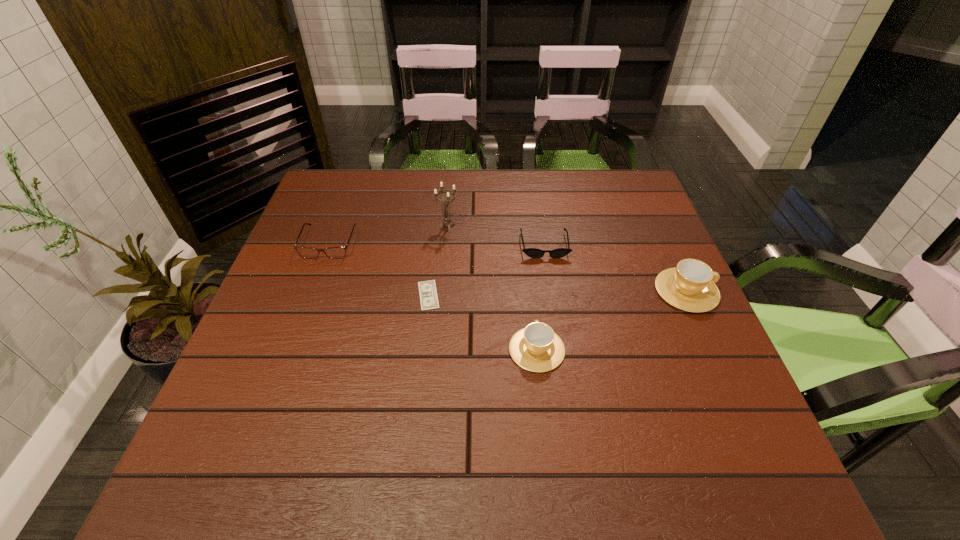
This screenshot has height=540, width=960. Identify the location of empty space between the spectacles and the fifth tallest object. (437, 244).

Identify the location of free space between the shortest object and the second shortest object. (486, 270).

Point out which object is positioned as the third nearest to the shorter cup. Please provide its 2D coordinates. Your answer should be formatted as a tuple, i.e. [(x, y)], where the tuple contains the x and y coordinates of a point satisfying the conditions above.

[(690, 286)]

Image resolution: width=960 pixels, height=540 pixels. Find the location of `object that can be found as the closest to the shortest object`. object that can be found as the closest to the shortest object is located at coordinates (536, 348).

Locate an element on the screen. This screenshot has height=540, width=960. vacant space that satisfies the following two spatial constraints: 1. on the lenses of the money; 2. on the right side of the spectacles is located at coordinates (310, 295).

The image size is (960, 540). I want to click on free space that satisfies the following two spatial constraints: 1. on the lenses of the money; 2. on the right side of the leftmost object, so click(310, 295).

You are a GUI agent. You are given a task and a screenshot of the screen. Output one action in this format:
    pyautogui.click(x=<x>, y=<y>)
    Task: Click on the free location that satisfies the following two spatial constraints: 1. on the lenses of the shortest object; 2. on the left side of the leftmost object
    This screenshot has width=960, height=540.
    Given the screenshot: What is the action you would take?
    pyautogui.click(x=310, y=295)